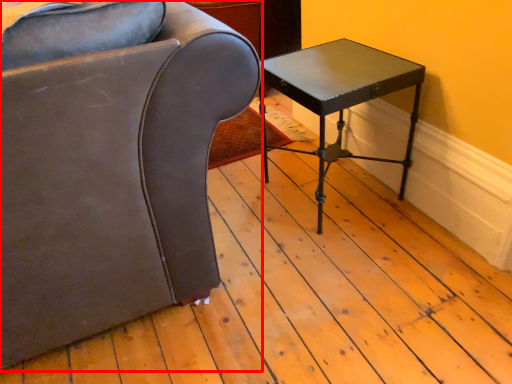
Question: Where is chair (annotated by the red box) located in relation to table in the image?

Choices:
 (A) left
 (B) right

Answer: (A)